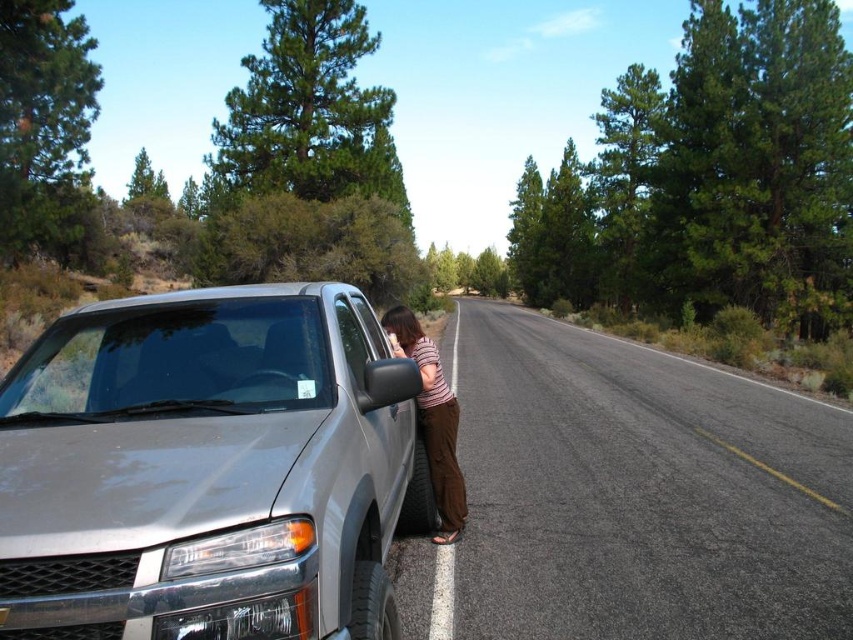
Question: Which of the following is the closest to the observer?

Choices:
 (A) pos(134,387)
 (B) pos(514,346)
 (C) pos(405,323)

Answer: (A)

Question: Is asphalt road at center to the left of matte brown hair at side from the viewer's perspective?

Choices:
 (A) yes
 (B) no

Answer: (B)

Question: Where is asphalt road at center located in relation to striped fabric shirt at center in the image?

Choices:
 (A) below
 (B) above

Answer: (A)

Question: Which point is farther to the camera?

Choices:
 (A) (404, 344)
 (B) (428, 410)

Answer: (A)

Question: Among these points, which one is nearest to the camera?

Choices:
 (A) (410, 397)
 (B) (778, 497)
 (C) (410, 314)

Answer: (A)

Question: Is asphalt road at center wider than matte brown hair at side?

Choices:
 (A) yes
 (B) no

Answer: (A)